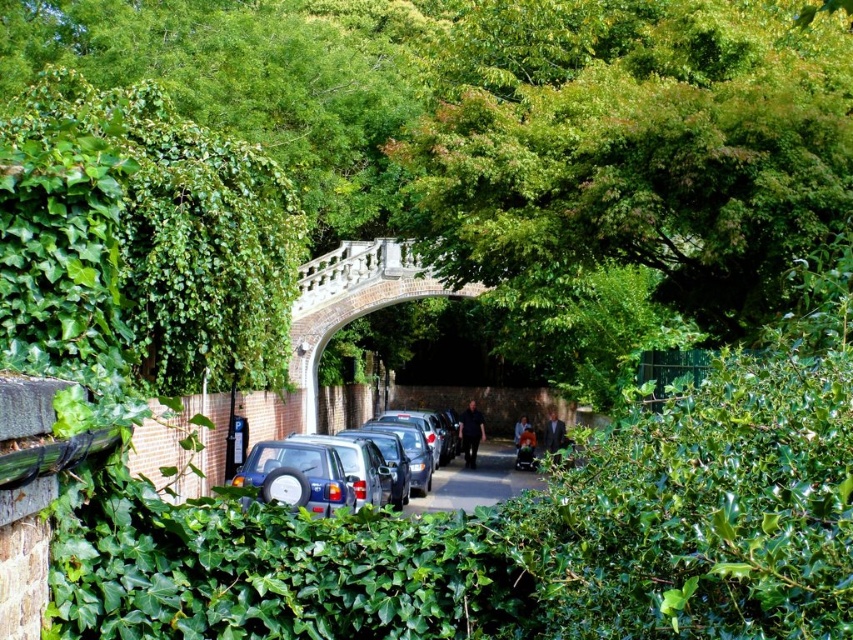
You are standing in front of the ivy covered wall and fence. There are two points marked on the wall at coordinates point [364,499] and point [498,456]. Which point is closer to your eyes?

Point [364,499] is closer to the camera than point [498,456], so the point [364,499] is closer to your eyes.

You are a parking attendant and need to fit a new car into the space between the satin silver car at center and the metallic gray car at center. The new car is 1.8 meters wide. Can the new car fit in the space?

The satin silver car at center is narrower than the metallic gray car at center. The space between them would depend on their widths, but since the satin silver car at center is narrower, there might be enough space. However, without knowing the exact distance between the cars, we can only confirm that the satin silver car at center is less wide than the metallic gray car at center.

From the picture: You are a driver trying to park your car in the narrow road between the ivy wall and fence. You see the satin silver car at center and the metallic gray car at center. Which car takes up less space in the parking spot?

The satin silver car at center has a smaller size compared to metallic gray car at center, so it takes up less space in the parking spot.